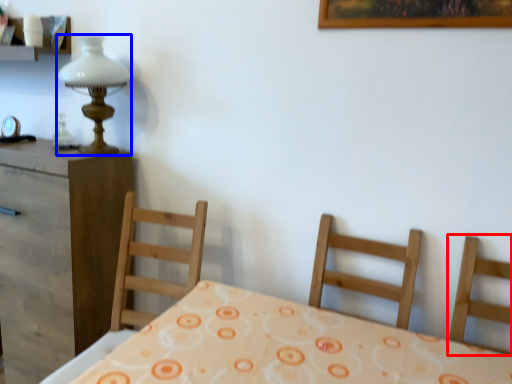
Question: Among these objects, which one is nearest to the camera, chair (highlighted by a red box) or table lamp (highlighted by a blue box)?

Choices:
 (A) chair
 (B) table lamp

Answer: (A)